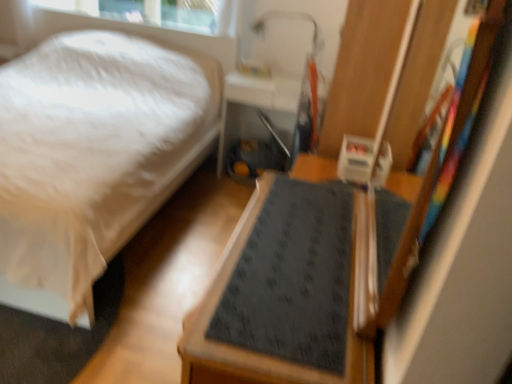
The height and width of the screenshot is (384, 512). What do you see at coordinates (92, 157) in the screenshot?
I see `white soft bed at lower left` at bounding box center [92, 157].

Image resolution: width=512 pixels, height=384 pixels. Identify the location of dark gray textured mat at center. (269, 355).

From the picture: Is metallic silver tray at center at the left side of white soft bed at lower left?

No.

In the image, there is a white soft bed at lower left. Where is `table below it (from a real-world perspective)`? This screenshot has height=384, width=512. table below it (from a real-world perspective) is located at coordinates (256, 107).

Is metallic silver tray at center oriented towards white soft bed at lower left?

No, metallic silver tray at center is not facing towards white soft bed at lower left.

Does dark gray textured mat at center turn towards white soft bed at lower left?

Yes, dark gray textured mat at center is facing white soft bed at lower left.

Is dark gray textured mat at center positioned beyond the bounds of white soft bed at lower left?

dark gray textured mat at center lies outside white soft bed at lower left's area.

In the scene shown: Is dark gray textured mat at center touching white soft bed at lower left?

No, dark gray textured mat at center is not next to white soft bed at lower left.

From a real-world perspective, is dark gray textured mat at center under white soft bed at lower left?

Yes, from a real-world perspective, dark gray textured mat at center is beneath white soft bed at lower left.

Looking at their sizes, would you say metallic silver tray at center is wider or thinner than dark gray textured mat at center?

Clearly, metallic silver tray at center has less width compared to dark gray textured mat at center.

Is metallic silver tray at center far away from dark gray textured mat at center?

That's right, there is a large distance between metallic silver tray at center and dark gray textured mat at center.

Could dark gray textured mat at center be considered to be inside metallic silver tray at center?

Definitely not — dark gray textured mat at center is not inside metallic silver tray at center.

Between metallic silver tray at center and dark gray textured mat at center, which one is positioned behind?

metallic silver tray at center is behind.

Which object is closer to the camera, dark gray textured mat at center or metallic silver tray at center?

dark gray textured mat at center is more forward.

From the image's perspective, would you say dark gray textured mat at center is shown under metallic silver tray at center?

Yes, from the image's perspective, dark gray textured mat at center is beneath metallic silver tray at center.

Is dark gray textured mat at center at the left side of metallic silver tray at center?

No.

From a real-world perspective, is dark gray textured mat at center positioned above or below metallic silver tray at center?

dark gray textured mat at center is situated lower than metallic silver tray at center in the real world.

Considering the sizes of objects white soft bed at lower left and dark gray textured mat at center in the image provided, who is wider, white soft bed at lower left or dark gray textured mat at center?

With larger width is white soft bed at lower left.

What's the angular difference between white soft bed at lower left and dark gray textured mat at center's facing directions?

white soft bed at lower left and dark gray textured mat at center are facing 91.2 degrees away from each other.

Who is smaller, white soft bed at lower left or dark gray textured mat at center?

With smaller size is dark gray textured mat at center.

I want to click on furniture below the white soft bed at lower left (from the image's perspective), so click(x=269, y=355).

Which of these two, white soft bed at lower left or metallic silver tray at center, is bigger?

With larger size is white soft bed at lower left.

At what (x,y) coordinates should I click in order to perform the action: click on bed located above the metallic silver tray at center (from a real-world perspective). Please return your answer as a coordinate pair (x, y). The image size is (512, 384). Looking at the image, I should click on (92, 157).

Is white soft bed at lower left facing towards metallic silver tray at center?

No, white soft bed at lower left is not aimed at metallic silver tray at center.

In the scene shown: Considering the positions of objects white soft bed at lower left and metallic silver tray at center in the image provided, who is more to the left, white soft bed at lower left or metallic silver tray at center?

white soft bed at lower left is more to the left.

Identify the location of bed that is above the metallic silver tray at center (from a real-world perspective). This screenshot has height=384, width=512. (92, 157).

Locate an element on the screen. This screenshot has height=384, width=512. bed lying on the left of dark gray textured mat at center is located at coordinates (92, 157).

Estimate the real-world distances between objects in this image. Which object is further from dark gray textured mat at center, metallic silver tray at center or white soft bed at lower left?

The object further to dark gray textured mat at center is metallic silver tray at center.

Looking at the image, which one is located closer to metallic silver tray at center, dark gray textured mat at center or white soft bed at lower left?

Based on the image, white soft bed at lower left appears to be nearer to metallic silver tray at center.

Considering their positions, is metallic silver tray at center positioned closer to white soft bed at lower left than dark gray textured mat at center?

Among the two, metallic silver tray at center is located nearer to white soft bed at lower left.

From the image, which object appears to be farther from metallic silver tray at center, white soft bed at lower left or dark gray textured mat at center?

dark gray textured mat at center lies further to metallic silver tray at center than the other object.

From the picture: Based on their spatial positions, is white soft bed at lower left or metallic silver tray at center further from dark gray textured mat at center?

metallic silver tray at center lies further to dark gray textured mat at center than the other object.

Based on the photo, considering their positions, is dark gray textured mat at center positioned further to white soft bed at lower left than metallic silver tray at center?

The object further to white soft bed at lower left is dark gray textured mat at center.

What are the coordinates of `bed between dark gray textured mat at center and metallic silver tray at center in the front-back direction` in the screenshot? It's located at (92, 157).